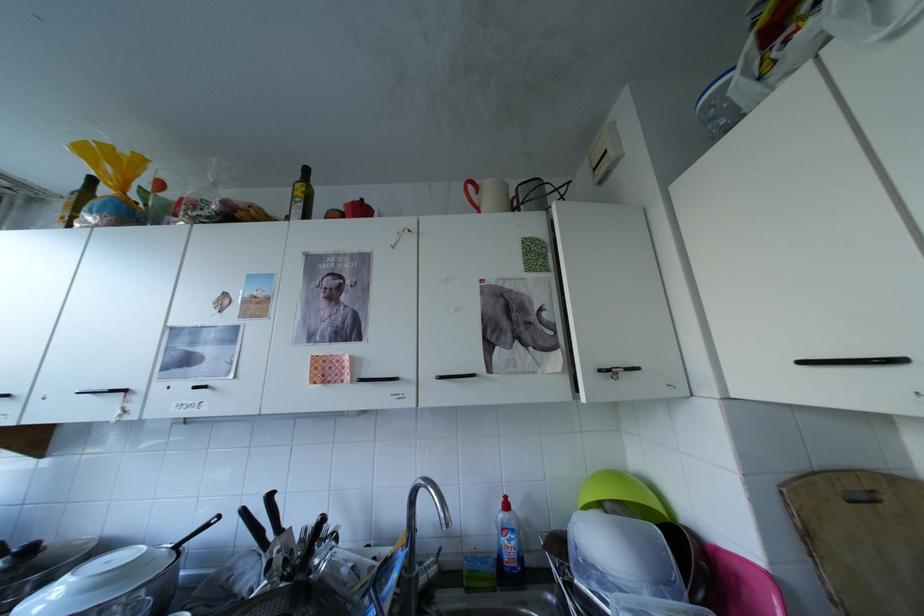
The image size is (924, 616). What are the coordinates of `green glass bottle` in the screenshot? It's located at click(301, 196).